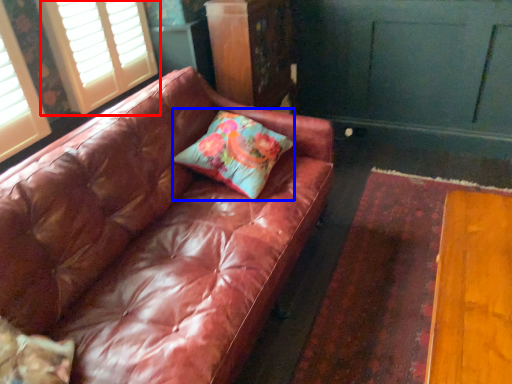
Question: Which of the following is the farthest to the observer, window (highlighted by a red box) or pillow (highlighted by a blue box)?

Choices:
 (A) window
 (B) pillow

Answer: (A)